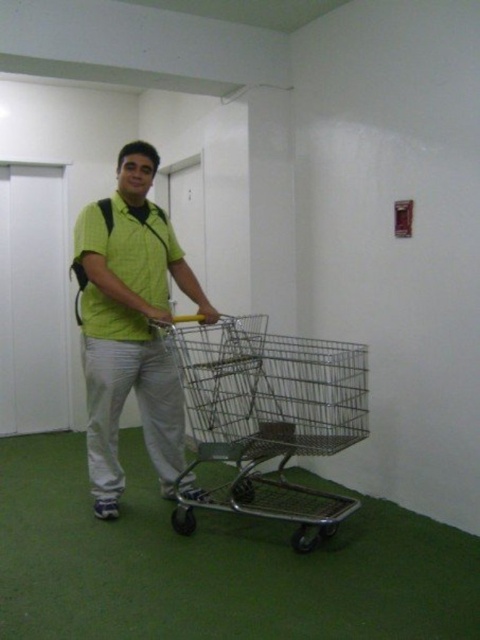
Does point (247, 376) come in front of point (118, 300)?

No, it is not.

Which is behind, point (307, 545) or point (97, 296)?

The point (97, 296) is more distant.

Where is `metallic wire trolley at center`? metallic wire trolley at center is located at coordinates (267, 417).

Who is lower down, green matte shirt at center or green matte polo shirt at center?

green matte shirt at center

What do you see at coordinates (130, 324) in the screenshot? I see `green matte shirt at center` at bounding box center [130, 324].

Find the location of a particular element. green matte shirt at center is located at coordinates (130, 324).

Between metallic wire trolley at center and green matte polo shirt at center, which one has less height?

green matte polo shirt at center

Measure the distance between metallic wire trolley at center and green matte polo shirt at center.

A distance of 29.04 inches exists between metallic wire trolley at center and green matte polo shirt at center.

Find the location of a particular element. Image resolution: width=480 pixels, height=640 pixels. metallic wire trolley at center is located at coordinates (267, 417).